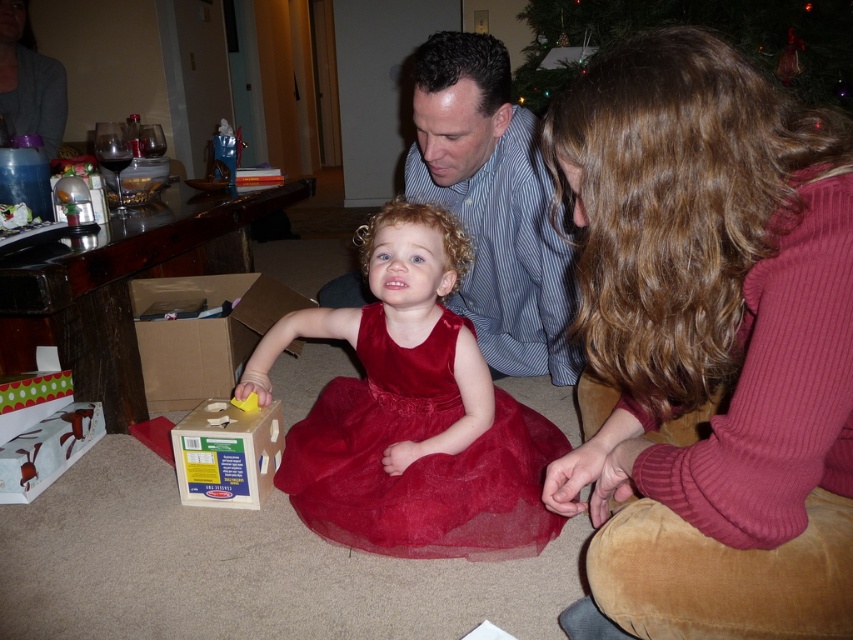
Can you confirm if satin tulle dress at center is bigger than cardboard box at lower left?

Correct, satin tulle dress at center is larger in size than cardboard box at lower left.

Is point (450, 524) closer to viewer compared to point (183, 332)?

Yes, point (450, 524) is closer to viewer.

At what (x,y) coordinates should I click in order to perform the action: click on satin tulle dress at center. Please return your answer as a coordinate pair (x, y). Looking at the image, I should click on (419, 458).

Is velvet maroon sweater at lower right shorter than green glittering ornaments at upper center?

Incorrect, velvet maroon sweater at lower right's height does not fall short of green glittering ornaments at upper center's.

Between velvet maroon sweater at lower right and green glittering ornaments at upper center, which one is positioned higher?

green glittering ornaments at upper center is above.

Image resolution: width=853 pixels, height=640 pixels. I want to click on velvet maroon sweater at lower right, so click(711, 342).

From the picture: Is velvet maroon sweater at lower right above wooden box at center?

Yes, velvet maroon sweater at lower right is above wooden box at center.

Between point (618, 408) and point (202, 404), which one is positioned behind?

The point (202, 404) is behind.

Locate an element on the screen. velvet maroon sweater at lower right is located at coordinates (711, 342).